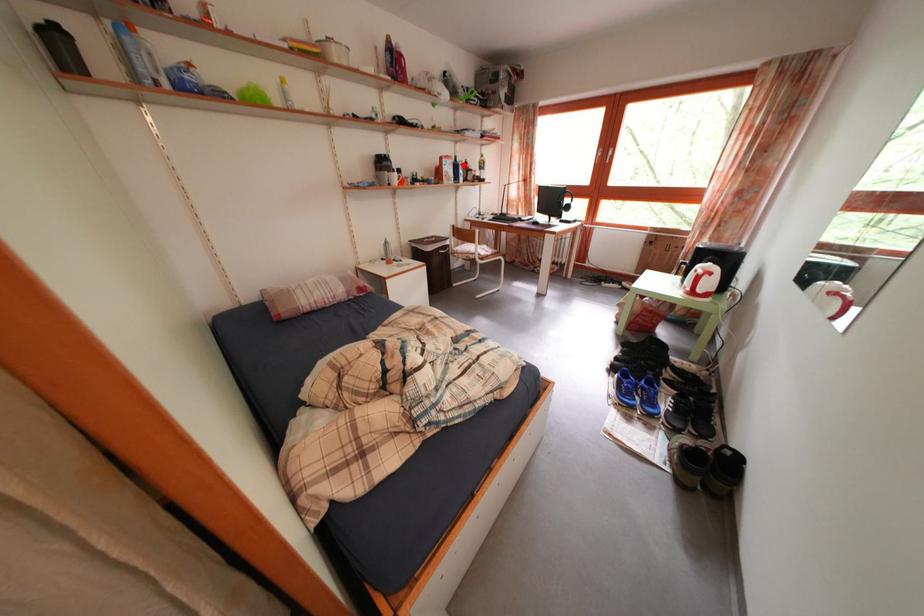
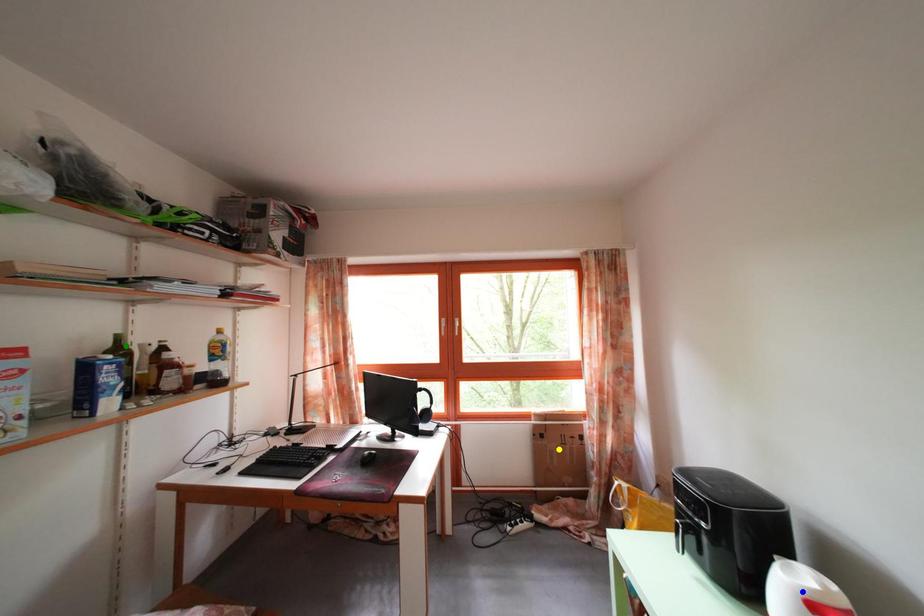
Question: I am providing you with two images of the same scene from different viewpoints. A red point is marked on the first image. You are given multiple points on the second image. In image 2, which mark is for the same physical point as the one in image 1?

Choices:
 (A) yellow point
 (B) green point
 (C) blue point

Answer: (B)